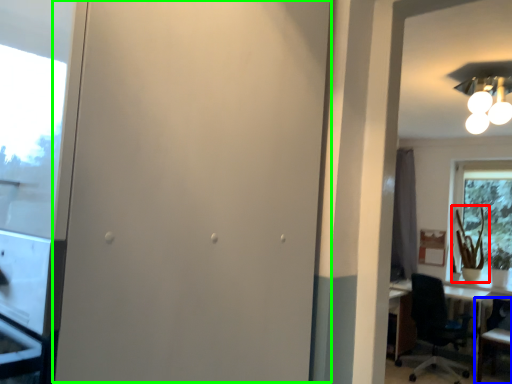
Question: Which is farther away from plant (highlighted by a red box)? chair (highlighted by a blue box) or screen door (highlighted by a green box)?

Choices:
 (A) chair
 (B) screen door

Answer: (B)